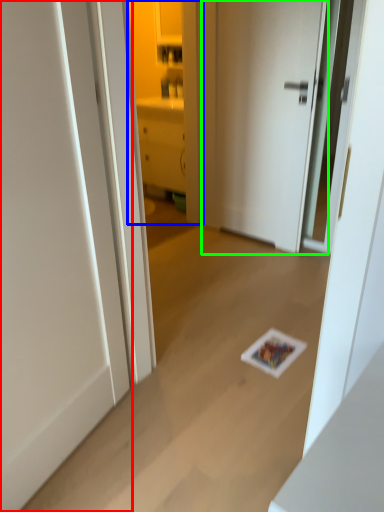
Question: Which object is positioned farthest from door (highlighted by a red box)? Select from cabinetry (highlighted by a blue box) and door (highlighted by a green box).

Choices:
 (A) cabinetry
 (B) door

Answer: (A)